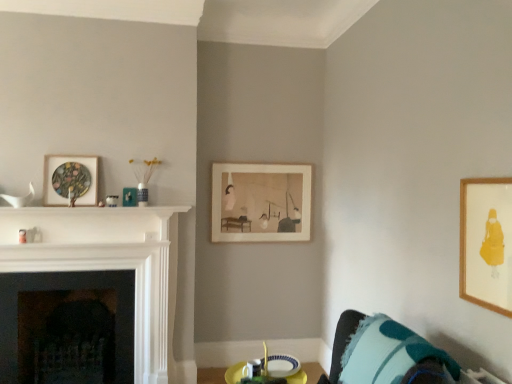
Measure the distance between teal fabric pillow at lower right and camera.

The distance of teal fabric pillow at lower right from camera is 1.60 meters.

Describe the element at coordinates (486, 243) in the screenshot. I see `wooden framed print at upper right, which is the third picture frame from back to front` at that location.

You are a GUI agent. You are given a task and a screenshot of the screen. Output one action in this format:
    pyautogui.click(x=<x>, y=<y>)
    Task: Click on the black stone fireplace at left, the first fireplace when ordered from back to front
    Image resolution: width=512 pixels, height=384 pixels.
    Given the screenshot: What is the action you would take?
    pyautogui.click(x=67, y=327)

In order to face wooden framed artwork at center, which is the first picture frame from back to front, should I rotate leftwards or rightwards?

You should look right and rotate roughly 1.142 degrees.

The height and width of the screenshot is (384, 512). I want to click on teal fabric pillow at lower right, so click(x=394, y=356).

Consider the image. From a real-world perspective, is wooden framed artwork at center, the 3th picture frame viewed from the front, physically below black stone fireplace at left, placed as the 2th fireplace when sorted from front to back?

Actually, wooden framed artwork at center, the 3th picture frame viewed from the front, is physically above black stone fireplace at left, placed as the 2th fireplace when sorted from front to back, in the real world.

Is point (251, 208) less distant than point (8, 298)?

No.

From their relative heights in the image, would you say wooden framed artwork at center, marked as the second picture frame in a right-to-left arrangement, is taller or shorter than black stone fireplace at left, the first fireplace when ordered from back to front?

wooden framed artwork at center, marked as the second picture frame in a right-to-left arrangement, is shorter than black stone fireplace at left, the first fireplace when ordered from back to front.

Is wooden framed artwork at center, the 3th picture frame viewed from the front, positioned far away from teal fabric pillow at lower right?

Indeed, wooden framed artwork at center, the 3th picture frame viewed from the front, is not near teal fabric pillow at lower right.

Could you tell me if wooden framed artwork at center, marked as the second picture frame in a right-to-left arrangement, is facing teal fabric pillow at lower right?

Yes.

Is point (311, 183) positioned behind point (457, 368)?

Yes, point (311, 183) is behind point (457, 368).

Does wooden framed artwork at center, which is the second picture frame in left-to-right order, have a larger size compared to teal fabric pillow at lower right?

Actually, wooden framed artwork at center, which is the second picture frame in left-to-right order, might be smaller than teal fabric pillow at lower right.

Is wooden framed print at upper right, which is counted as the first picture frame, starting from the right, located outside teal fabric pillow at lower right?

That's correct, wooden framed print at upper right, which is counted as the first picture frame, starting from the right, is outside of teal fabric pillow at lower right.

Between wooden framed print at upper right, the 3th picture frame positioned from the left, and teal fabric pillow at lower right, which one appears on the right side from the viewer's perspective?

wooden framed print at upper right, the 3th picture frame positioned from the left, is more to the right.

Considering the relative sizes of wooden framed print at upper right, the 3th picture frame positioned from the left, and teal fabric pillow at lower right in the image provided, is wooden framed print at upper right, the 3th picture frame positioned from the left, smaller than teal fabric pillow at lower right?

Yes.

From the image's perspective, which one is positioned higher, wooden framed print at upper right, the 3th picture frame positioned from the left, or teal fabric pillow at lower right?

wooden framed print at upper right, the 3th picture frame positioned from the left.

Is matte wooden picture frame at upper left, arranged as the 2th picture frame when viewed from the front, aimed at teal fabric pillow at lower right?

Answer: No, matte wooden picture frame at upper left, arranged as the 2th picture frame when viewed from the front, is not turned towards teal fabric pillow at lower right.

Does matte wooden picture frame at upper left, arranged as the 2th picture frame when viewed from the front, appear on the right side of teal fabric pillow at lower right?

Incorrect, matte wooden picture frame at upper left, arranged as the 2th picture frame when viewed from the front, is not on the right side of teal fabric pillow at lower right.

Between matte wooden picture frame at upper left, acting as the 1th picture frame starting from the left, and teal fabric pillow at lower right, which one has smaller size?

matte wooden picture frame at upper left, acting as the 1th picture frame starting from the left.

Can teal fabric pillow at lower right be found inside matte wooden picture frame at upper left, acting as the third picture frame starting from the right?

No, teal fabric pillow at lower right is not a part of matte wooden picture frame at upper left, acting as the third picture frame starting from the right.

Is black stone fireplace at left, the first fireplace when ordered from back to front, completely or partially outside of white glossy fireplace at left, which ranks as the 1th fireplace in front-to-back order?

That's correct, black stone fireplace at left, the first fireplace when ordered from back to front, is outside of white glossy fireplace at left, which ranks as the 1th fireplace in front-to-back order.

Between black stone fireplace at left, placed as the 2th fireplace when sorted from front to back, and white glossy fireplace at left, which ranks as the 1th fireplace in front-to-back order, which one has smaller size?

white glossy fireplace at left, which ranks as the 1th fireplace in front-to-back order, is smaller.

Would you say black stone fireplace at left, placed as the 2th fireplace when sorted from front to back, is a long distance from white glossy fireplace at left, which is counted as the 2th fireplace, starting from the back?

Actually, black stone fireplace at left, placed as the 2th fireplace when sorted from front to back, and white glossy fireplace at left, which is counted as the 2th fireplace, starting from the back, are a little close together.

From a real-world perspective, which is physically below, black stone fireplace at left, the first fireplace when ordered from back to front, or white glossy fireplace at left, which is counted as the 2th fireplace, starting from the back?

In real-world perspective, black stone fireplace at left, the first fireplace when ordered from back to front, is lower.

Would you say wooden framed artwork at center, which is the second picture frame in left-to-right order, is to the left or to the right of wooden framed print at upper right, which is counted as the first picture frame, starting from the right, in the picture?

In the image, wooden framed artwork at center, which is the second picture frame in left-to-right order, appears on the left side of wooden framed print at upper right, which is counted as the first picture frame, starting from the right.

From the image's perspective, is wooden framed artwork at center, the 3th picture frame viewed from the front, located above or below wooden framed print at upper right, the 3th picture frame positioned from the left?

wooden framed artwork at center, the 3th picture frame viewed from the front, is above wooden framed print at upper right, the 3th picture frame positioned from the left.

In the scene shown: Considering the positions of objects wooden framed artwork at center, which is the first picture frame from back to front, and wooden framed print at upper right, which is the first picture frame from front to back, in the image provided, who is behind, wooden framed artwork at center, which is the first picture frame from back to front, or wooden framed print at upper right, which is the first picture frame from front to back,?

wooden framed artwork at center, which is the first picture frame from back to front, is further from the camera.

Which of these two, black stone fireplace at left, the first fireplace when ordered from back to front, or wooden framed artwork at center, which is the first picture frame from back to front, is smaller?

Smaller between the two is wooden framed artwork at center, which is the first picture frame from back to front.

From the image's perspective, is black stone fireplace at left, placed as the 2th fireplace when sorted from front to back, above or below wooden framed artwork at center, which is the second picture frame in left-to-right order?

black stone fireplace at left, placed as the 2th fireplace when sorted from front to back, is below wooden framed artwork at center, which is the second picture frame in left-to-right order.

From a real-world perspective, is black stone fireplace at left, the first fireplace when ordered from back to front, under wooden framed artwork at center, marked as the second picture frame in a right-to-left arrangement?

Yes, from a real-world perspective, black stone fireplace at left, the first fireplace when ordered from back to front, is below wooden framed artwork at center, marked as the second picture frame in a right-to-left arrangement.

From a real-world perspective, count 2nd fireplaces downward from the wooden framed artwork at center, which is the first picture frame from back to front, and point to it. Please provide its 2D coordinates.

[(67, 327)]

From the image's perspective, count 2nd picture frames upward from the teal fabric pillow at lower right and point to it. Please provide its 2D coordinates.

[(261, 202)]

Based on their spatial positions, is matte wooden picture frame at upper left, arranged as the 2th picture frame when viewed from the front, or teal fabric pillow at lower right further from wooden framed artwork at center, marked as the second picture frame in a right-to-left arrangement?

Based on the image, teal fabric pillow at lower right appears to be further to wooden framed artwork at center, marked as the second picture frame in a right-to-left arrangement.

From the image, which object appears to be farther from white glossy fireplace at left, which ranks as the 1th fireplace in front-to-back order, teal fabric pillow at lower right or wooden framed artwork at center, which is the second picture frame in left-to-right order?

Based on the image, teal fabric pillow at lower right appears to be further to white glossy fireplace at left, which ranks as the 1th fireplace in front-to-back order.

Estimate the real-world distances between objects in this image. Which object is closer to matte wooden picture frame at upper left, acting as the 1th picture frame starting from the left, teal fabric pillow at lower right or wooden framed artwork at center, which is the second picture frame in left-to-right order?

wooden framed artwork at center, which is the second picture frame in left-to-right order, is closer to matte wooden picture frame at upper left, acting as the 1th picture frame starting from the left.

Based on their spatial positions, is wooden framed print at upper right, which is the first picture frame from front to back, or matte wooden picture frame at upper left, arranged as the 2th picture frame when viewed from the front, further from white glossy fireplace at left, which is counted as the 2th fireplace, starting from the back?

wooden framed print at upper right, which is the first picture frame from front to back.

Considering their positions, is white glossy fireplace at left, which ranks as the 1th fireplace in front-to-back order, positioned closer to wooden framed artwork at center, which is the second picture frame in left-to-right order, than black stone fireplace at left, placed as the 2th fireplace when sorted from front to back?

The object closer to wooden framed artwork at center, which is the second picture frame in left-to-right order, is white glossy fireplace at left, which ranks as the 1th fireplace in front-to-back order.

Estimate the real-world distances between objects in this image. Which object is further from wooden framed print at upper right, the 3th picture frame positioned from the left, white glossy fireplace at left, which ranks as the 1th fireplace in front-to-back order, or teal fabric pillow at lower right?

Answer: Among the two, white glossy fireplace at left, which ranks as the 1th fireplace in front-to-back order, is located further to wooden framed print at upper right, the 3th picture frame positioned from the left.

In the scene shown: When comparing their distances from white glossy fireplace at left, which ranks as the 1th fireplace in front-to-back order, does wooden framed artwork at center, which is the first picture frame from back to front, or matte wooden picture frame at upper left, arranged as the 2th picture frame when viewed from the front, seem further?

wooden framed artwork at center, which is the first picture frame from back to front, lies further to white glossy fireplace at left, which ranks as the 1th fireplace in front-to-back order, than the other object.

Consider the image. Estimate the real-world distances between objects in this image. Which object is closer to teal fabric pillow at lower right, white glossy fireplace at left, which is counted as the 2th fireplace, starting from the back, or wooden framed artwork at center, the 3th picture frame viewed from the front?

white glossy fireplace at left, which is counted as the 2th fireplace, starting from the back, is closer to teal fabric pillow at lower right.

Locate an element on the screen. pillow between white glossy fireplace at left, which ranks as the 1th fireplace in front-to-back order, and wooden framed print at upper right, which is the first picture frame from front to back, in the horizontal direction is located at coordinates (394, 356).

The width and height of the screenshot is (512, 384). What are the coordinates of `fireplace between black stone fireplace at left, placed as the 2th fireplace when sorted from front to back, and wooden framed artwork at center, which is the second picture frame in left-to-right order` in the screenshot? It's located at pyautogui.click(x=108, y=262).

This screenshot has height=384, width=512. Identify the location of fireplace between matte wooden picture frame at upper left, acting as the third picture frame starting from the right, and wooden framed artwork at center, the 3th picture frame viewed from the front. (108, 262).

I want to click on pillow between matte wooden picture frame at upper left, acting as the third picture frame starting from the right, and wooden framed print at upper right, which is the first picture frame from front to back, in the horizontal direction, so click(x=394, y=356).